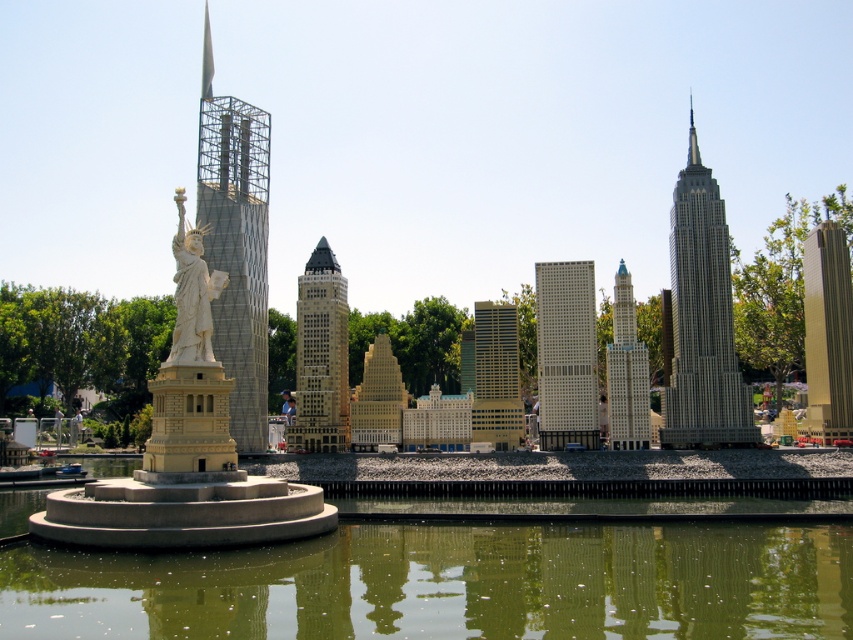
Is point (648, 525) positioned after point (221, 348)?

No, it is not.

This screenshot has width=853, height=640. Describe the element at coordinates (450, 584) in the screenshot. I see `green reflective water at center` at that location.

I want to click on green reflective water at center, so click(x=450, y=584).

Is brick textured building at center above gold metallic building at center?

Correct, brick textured building at center is located above gold metallic building at center.

Between brick textured building at center and gold metallic building at center, which one has less height?

gold metallic building at center is shorter.

Between point (329, 400) and point (492, 392), which one is positioned behind?

Point (329, 400)

Where is `brick textured building at center`? brick textured building at center is located at coordinates (320, 356).

Is point (822, 420) in front of point (381, 353)?

That is True.

Find the location of a particular element. gold metallic tower at right is located at coordinates (827, 333).